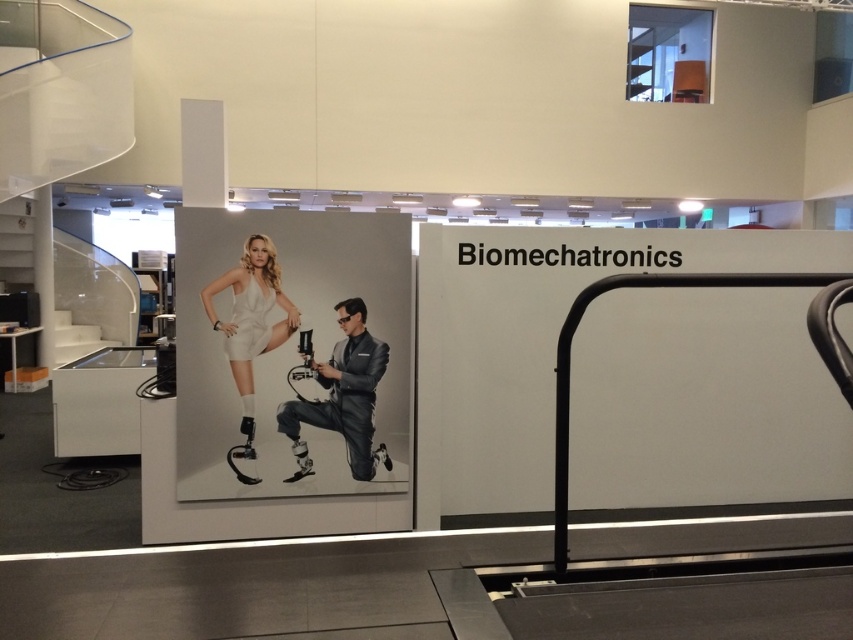
Looking at this image, what is the spatial relationship between the black metal rail at right and the shiny metallic suit at center in the Biomechatronics exhibition display?

The black metal rail at right is positioned to the right of the shiny metallic suit at center.

You are an attendee at the Biomechatronics exhibition. You see a shiny metallic suit at center and a white glossy stair at left. Which object is positioned to the right of the other?

The shiny metallic suit at center is to the right of white glossy stair at left.